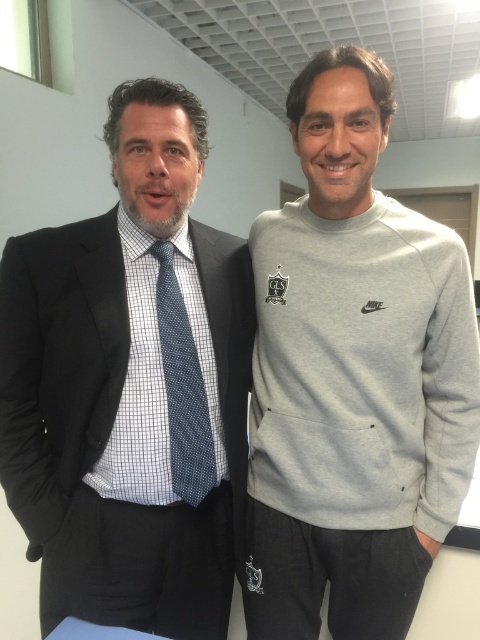
You are a photographer setting up for a group photo. You need to position the matte black suit at left and the gray fleece sweatshirt at right so that both are clearly visible. Given their current positions, which person should you move forward to ensure both are visible?

The gray fleece sweatshirt at right should be moved forward because the matte black suit at left is already in front of it, so moving the gray fleece sweatshirt at right forward would ensure both are visible.

Based on the photo, you are a photographer standing at the camera position. You want to take a photo of the two people in the scene. The focus point of your camera is set to point [149,508]. Is this focus point close enough to capture both individuals clearly in focus?

The focus point at point [149,508] is 1.07 meters away from the camera. Since the depth of field at this distance can vary depending on the aperture setting, but typically, if both subjects are within a reasonable distance range from this focus point, they should be in acceptable focus. However, without knowing the exact aperture and lens focal length, it is difficult to guarantee perfect clarity for both. To ensure both are in focus, consider using a smaller aperture for greater depth of field or recom,

You are a photographer setting up for a group photo. You need to position the matte black suit at left and the blue dotted tie at center so that both are clearly visible in the frame. Given their current positions, which one is closer to the camera and might require adjusting to ensure both are equally visible?

The matte black suit at left is in front of the blue dotted tie at center, so it is closer to the camera. To ensure both are equally visible, you should move the blue dotted tie at center forward or the matte black suit at left backward.